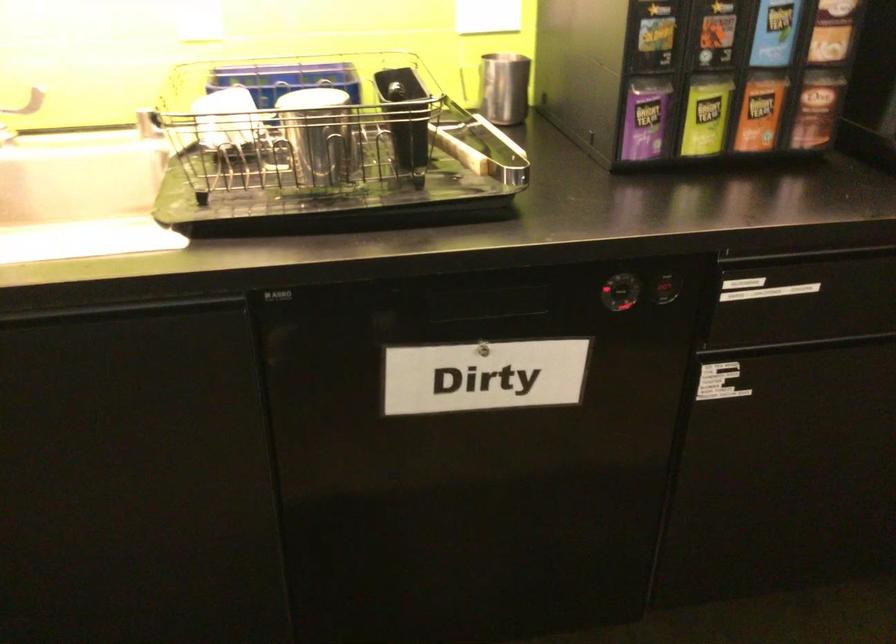
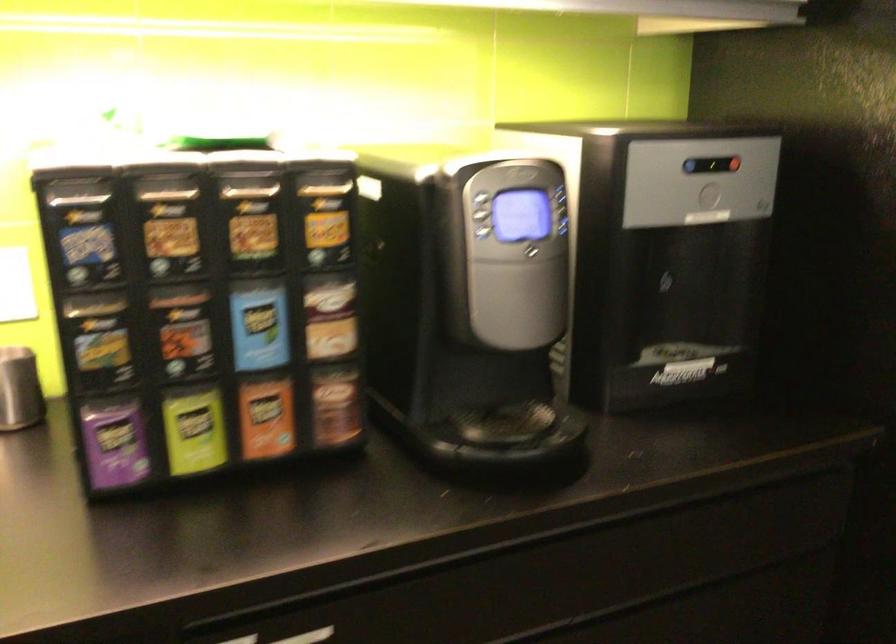
Locate, in the second image, the point that corresponds to point (642, 120) in the first image.

(114, 442)